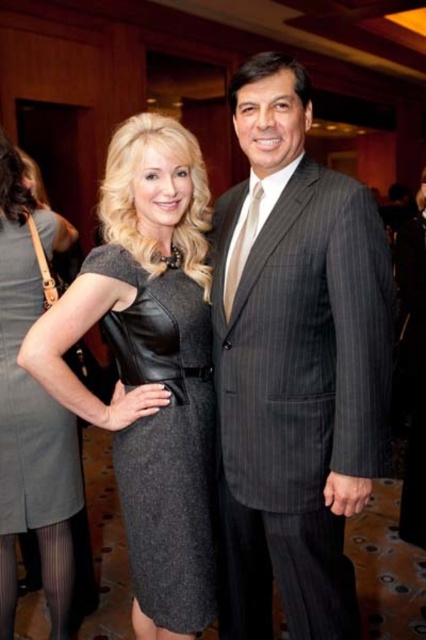
You are a photographer at a formal event and need to decide which dress to feature in a closeup shot. The black leather dress at center and the gray leather dress at center are both options. Which dress should you choose if you want to capture a wider silhouette in your photo?

The black leather dress at center has a larger width than the gray leather dress at center, so it would be the better choice for capturing a wider silhouette in the photo.